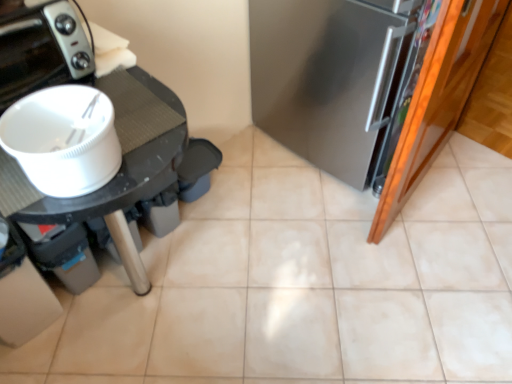
Question: Is white matte bowl at left not inside black glossy toaster at upper left?

Choices:
 (A) yes
 (B) no

Answer: (A)

Question: Does white matte bowl at left turn towards black glossy toaster at upper left?

Choices:
 (A) no
 (B) yes

Answer: (A)

Question: Can you confirm if white matte bowl at left is taller than black glossy toaster at upper left?

Choices:
 (A) no
 (B) yes

Answer: (A)

Question: Is white matte bowl at left smaller than black glossy toaster at upper left?

Choices:
 (A) yes
 (B) no

Answer: (A)

Question: Does white matte bowl at left lie in front of black glossy toaster at upper left?

Choices:
 (A) no
 (B) yes

Answer: (B)

Question: Is there a large distance between white matte bowl at left and black glossy toaster at upper left?

Choices:
 (A) no
 (B) yes

Answer: (A)

Question: Is satin silver refrigerator at right located within white matte bowl at left?

Choices:
 (A) no
 (B) yes

Answer: (A)

Question: Considering the relative sizes of white matte bowl at left and satin silver refrigerator at right in the image provided, is white matte bowl at left bigger than satin silver refrigerator at right?

Choices:
 (A) yes
 (B) no

Answer: (B)

Question: Considering the relative sizes of white matte bowl at left and satin silver refrigerator at right in the image provided, is white matte bowl at left smaller than satin silver refrigerator at right?

Choices:
 (A) no
 (B) yes

Answer: (B)

Question: Is white matte bowl at left positioned beyond the bounds of satin silver refrigerator at right?

Choices:
 (A) yes
 (B) no

Answer: (A)

Question: Is white matte bowl at left facing towards satin silver refrigerator at right?

Choices:
 (A) no
 (B) yes

Answer: (A)

Question: From a real-world perspective, is white matte bowl at left beneath satin silver refrigerator at right?

Choices:
 (A) no
 (B) yes

Answer: (A)

Question: Is the surface of satin silver refrigerator at right in direct contact with beige ceramic tile at center?

Choices:
 (A) yes
 (B) no

Answer: (B)